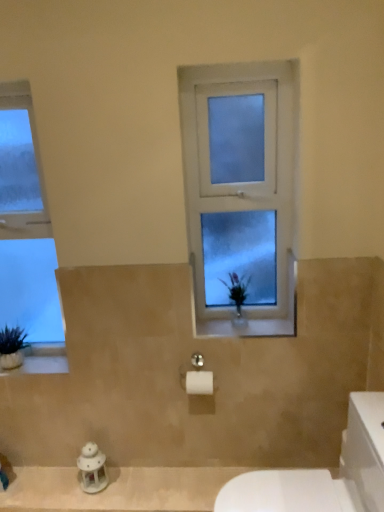
Locate an element on the screen. Image resolution: width=384 pixels, height=512 pixels. vacant area situated to the left side of white porcelain lantern at lower left is located at coordinates click(x=58, y=488).